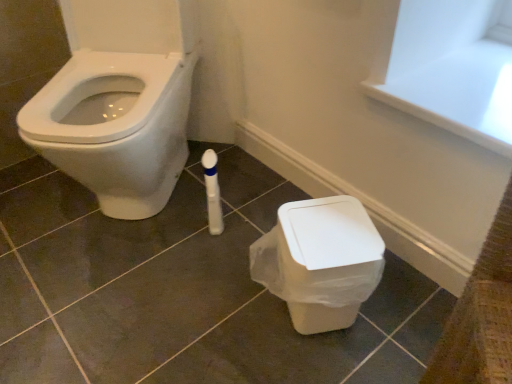
Locate an element on the screen. free space to the right of white plastic bin at lower right is located at coordinates (401, 313).